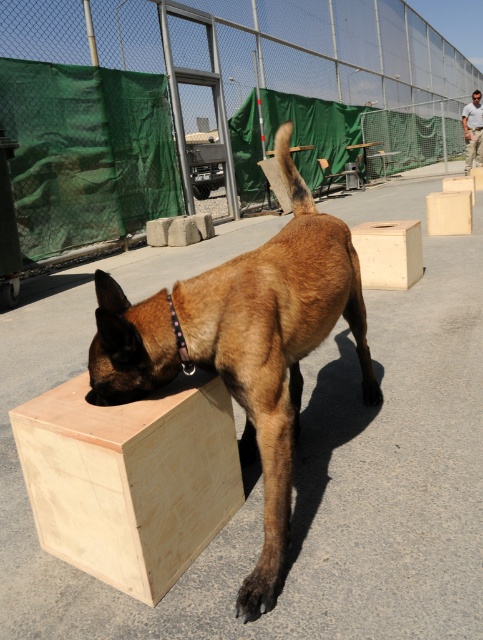
Question: Based on their relative distances, which object is nearer to the brown wooden dog at center?

Choices:
 (A) plywood box at center
 (B) light brown wood at center
 (C) green mesh fence at upper center
 (D) light brown wood at lower left

Answer: (D)

Question: Estimate the real-world distances between objects in this image. Which object is farther from the light brown wood at center?

Choices:
 (A) green mesh fence at upper center
 (B) plywood box at center
 (C) light brown wood at lower left

Answer: (A)

Question: Does green mesh fence at upper center appear on the right side of light brown wood at lower left?

Choices:
 (A) no
 (B) yes

Answer: (B)

Question: Which point is farther to the camera?

Choices:
 (A) (428, 209)
 (B) (406, 228)
 (C) (282, 513)

Answer: (A)

Question: Is brown wooden dog at center thinner than light brown wood at lower left?

Choices:
 (A) yes
 (B) no

Answer: (B)

Question: Is brown wooden dog at center wider than light brown wood at lower left?

Choices:
 (A) no
 (B) yes

Answer: (B)